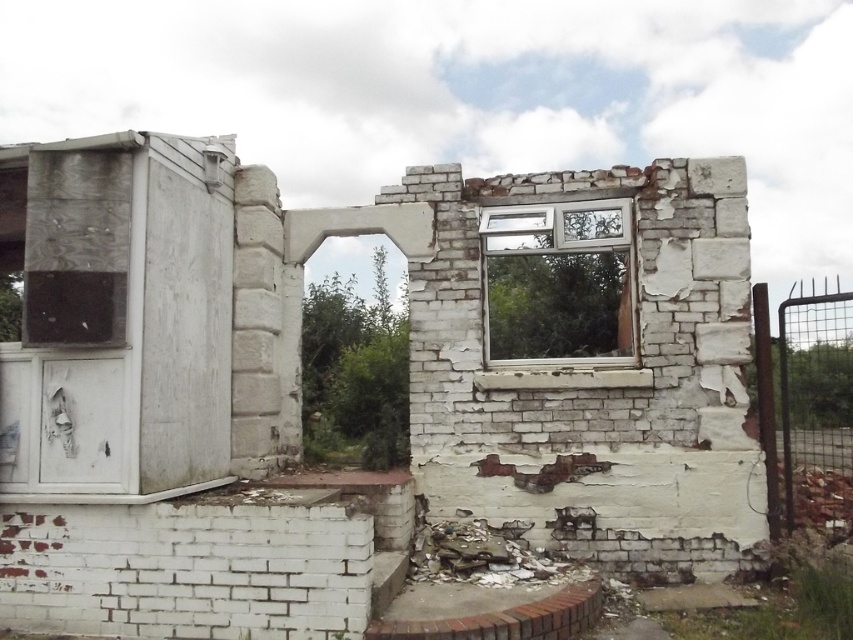
You are standing in front of the partially demolished structure and want to reach a point closer to the camera. Which of the two points, point (292, 630) or point (515, 314), should you aim for?

Point (292, 630) is closer to the camera than point (515, 314), so you should aim for point (292, 630).

You are a photographer standing at the camera position. You want to take a closeup shot of the white cracked brick ruins at center. Can you reach the ruins without moving the camera? The minimum focusing distance of your camera is 4 meters.

The white cracked brick ruins at center and camera are 4.32 meters apart. Since the minimum focusing distance is 4 meters, the camera can focus on the white cracked brick ruins at center from this distance.